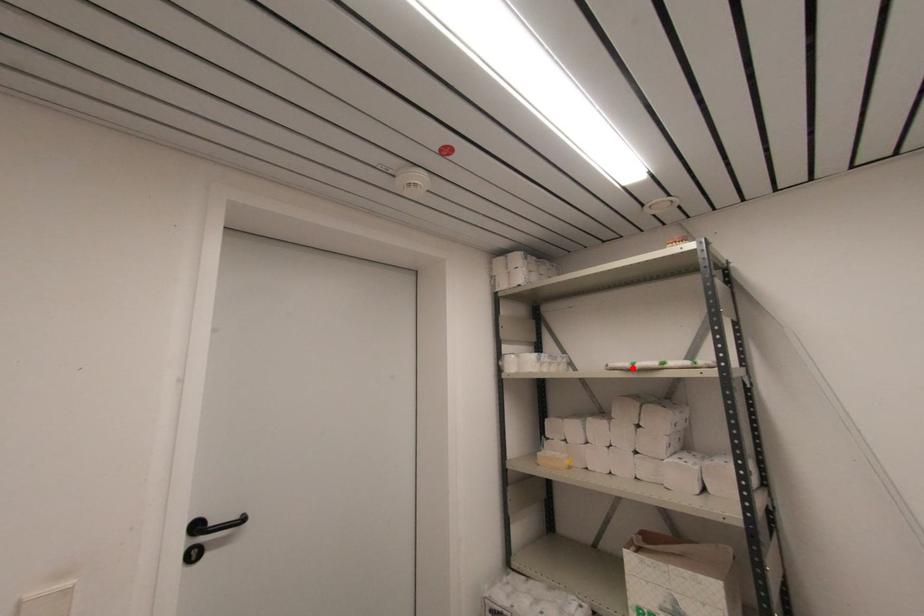
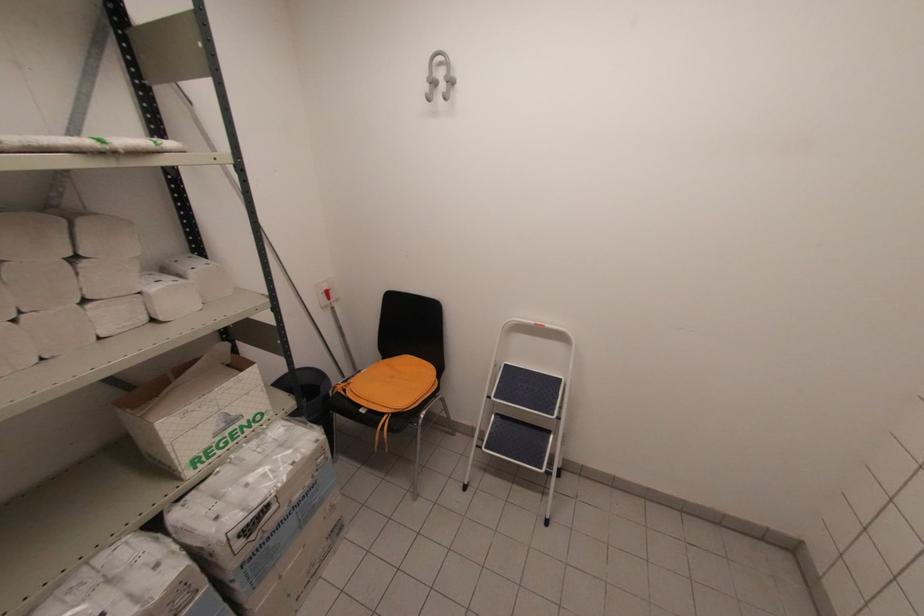
Locate, in the second image, the point that corresponds to the highlighted location in the first image.

(107, 148)